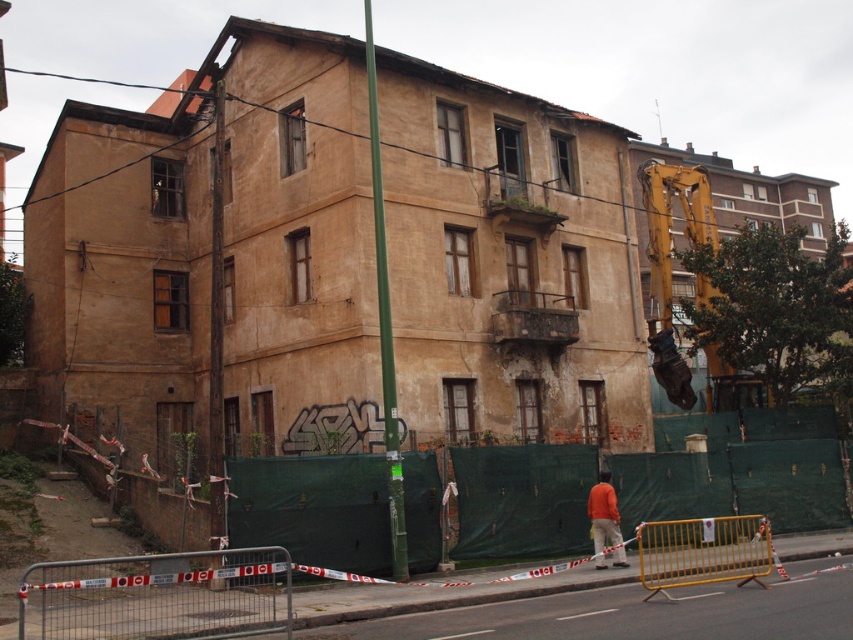
Question: Estimate the real-world distances between objects in this image. Which object is farther from the yellow metallic barricade at center?

Choices:
 (A) green metallic pole at center
 (B) orange fabric construction worker at lower center

Answer: (A)

Question: Can you confirm if yellow metallic barricade at center is positioned below orange fabric construction worker at lower center?

Choices:
 (A) yes
 (B) no

Answer: (A)

Question: Can you confirm if metal barricade at lower left is positioned above orange fabric construction worker at lower center?

Choices:
 (A) no
 (B) yes

Answer: (A)

Question: Based on their relative distances, which object is nearer to the green metallic pole at center?

Choices:
 (A) orange fabric construction worker at lower center
 (B) metal barricade at lower left
 (C) yellow metallic barricade at center

Answer: (A)

Question: Is metal barricade at lower left to the right of orange fabric construction worker at lower center from the viewer's perspective?

Choices:
 (A) no
 (B) yes

Answer: (A)

Question: Which of the following is the farthest from the observer?

Choices:
 (A) green metallic pole at center
 (B) metal barricade at lower left
 (C) orange fabric construction worker at lower center

Answer: (A)